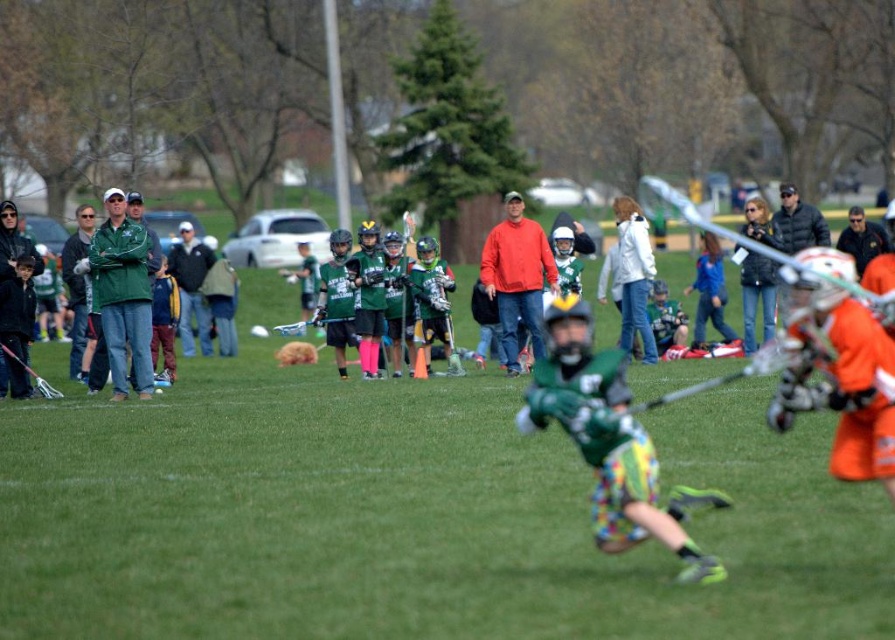
You are a photographer at the lacrosse game. You want to take a photo where both the green matte jersey at center and the orange fleece jacket at center are visible. Given their heights, which one might you need to adjust your camera angle to capture properly?

The green matte jersey at center is shorter than the orange fleece jacket at center, so you might need to lower your camera angle to ensure the shorter green matte jersey at center is fully visible while still capturing the taller orange fleece jacket at center.

What are the coordinates of the green matte jersey at center in the image?

The coordinates of the green matte jersey at center are at point (610, 442).